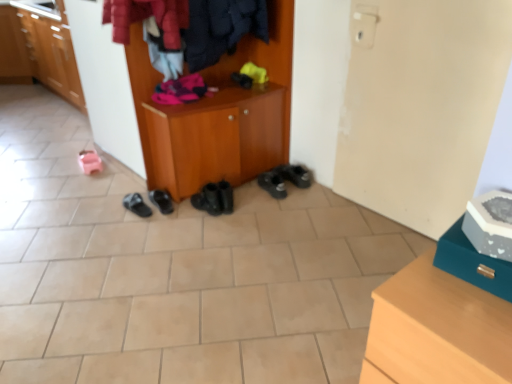
The height and width of the screenshot is (384, 512). What do you see at coordinates (217, 114) in the screenshot?
I see `wooden cabinet at center, the 1th cabinetry in the front-to-back sequence` at bounding box center [217, 114].

The width and height of the screenshot is (512, 384). What are the coordinates of `wooden cabinet at center, which appears as the second cabinetry when viewed from the left` in the screenshot? It's located at (217, 114).

Describe the element at coordinates (490, 224) in the screenshot. The width and height of the screenshot is (512, 384). I see `white matte shoe at upper right, the 2th shoe when ordered from bottom to top` at that location.

This screenshot has width=512, height=384. What are the coordinates of `velvet-like red coat at upper center` in the screenshot? It's located at (191, 25).

Image resolution: width=512 pixels, height=384 pixels. I want to click on matte wood cabinet at left, the second cabinetry positioned from the right, so click(x=39, y=48).

Measure the distance between point [282,167] and camera.

Point [282,167] is 2.88 meters away from camera.

Locate an element on the screen. wooden cabinet at center, placed as the second cabinetry when sorted from back to front is located at coordinates (217, 114).

Who is smaller, black rubber shoes at center, arranged as the 5th footwear when viewed from the left, or black rubber boots at center, arranged as the 3th footwear when viewed from the right?

black rubber boots at center, arranged as the 3th footwear when viewed from the right, is smaller.

What's the angular difference between black rubber shoes at center, the second footwear in the right-to-left sequence, and black rubber boots at center, the 4th footwear viewed from the left,'s facing directions?

There is a 14.4-degree angle between the facing directions of black rubber shoes at center, the second footwear in the right-to-left sequence, and black rubber boots at center, the 4th footwear viewed from the left.

From a real-world perspective, which object rests below the other?

black rubber shoes at center, the second footwear in the right-to-left sequence, from a real-world perspective.

Is black rubber boots at center, arranged as the 3th footwear when viewed from the right, turned away from matte wood cabinet at left, the second cabinetry positioned from the right?

Yes, black rubber boots at center, arranged as the 3th footwear when viewed from the right, is positioned with its back facing matte wood cabinet at left, the second cabinetry positioned from the right.

Can you see black rubber boots at center, arranged as the 3th footwear when viewed from the right, touching matte wood cabinet at left, the second cabinetry positioned from the right?

No, black rubber boots at center, arranged as the 3th footwear when viewed from the right, is not next to matte wood cabinet at left, the second cabinetry positioned from the right.

Considering the positions of objects black rubber boots at center, arranged as the 3th footwear when viewed from the right, and matte wood cabinet at left, which is the 1th cabinetry from top to bottom, in the image provided, who is behind, black rubber boots at center, arranged as the 3th footwear when viewed from the right, or matte wood cabinet at left, which is the 1th cabinetry from top to bottom,?

matte wood cabinet at left, which is the 1th cabinetry from top to bottom.

Considering the sizes of white matte shoe at upper right, the 2th shoe when ordered from bottom to top, and pink rubber sandals at lower left, which is the first footwear in left-to-right order, in the image, is white matte shoe at upper right, the 2th shoe when ordered from bottom to top, bigger or smaller than pink rubber sandals at lower left, which is the first footwear in left-to-right order,?

white matte shoe at upper right, the 2th shoe when ordered from bottom to top, is bigger than pink rubber sandals at lower left, which is the first footwear in left-to-right order.

From a real-world perspective, which is physically below, white matte shoe at upper right, marked as the first shoe in a top-to-bottom arrangement, or pink rubber sandals at lower left, marked as the 6th footwear in a right-to-left arrangement?

pink rubber sandals at lower left, marked as the 6th footwear in a right-to-left arrangement, is physically lower.

From the image's perspective, which is below, white matte shoe at upper right, marked as the first shoe in a top-to-bottom arrangement, or pink rubber sandals at lower left, which is the first footwear in left-to-right order?

white matte shoe at upper right, marked as the first shoe in a top-to-bottom arrangement, from the image's perspective.

From a real-world perspective, who is located lower, velvet-like red coat at upper center or black rubber shoes at center, the second footwear in the right-to-left sequence?

black rubber shoes at center, the second footwear in the right-to-left sequence, is physically lower.

In terms of height, does velvet-like red coat at upper center look taller or shorter compared to black rubber shoes at center, arranged as the 5th footwear when viewed from the left?

Considering their sizes, velvet-like red coat at upper center has more height than black rubber shoes at center, arranged as the 5th footwear when viewed from the left.

Which is behind, point (168, 5) or point (285, 166)?

Point (285, 166)

Relative to black rubber shoes at center, arranged as the 5th footwear when viewed from the left, is velvet-like red coat at upper center in front or behind?

velvet-like red coat at upper center is positioned closer to the viewer than black rubber shoes at center, arranged as the 5th footwear when viewed from the left.

From the picture: Is black rubber boots at center, the 4th footwear viewed from the left, surrounding white matte shoe at upper right, the 2th shoe when ordered from bottom to top?

No.

Is point (215, 188) closer to camera compared to point (507, 236)?

No, it is behind (507, 236).

From the black rubber boots at center, arranged as the 3th footwear when viewed from the right, count 1st shoe to the right and point to it. Please provide its 2D coordinates.

[(490, 224)]

Is wooden cabinet at center, which appears as the second cabinetry when viewed from the left, to the left or to the right of white matte shoe at upper right, marked as the first shoe in a top-to-bottom arrangement, in the image?

In the image, wooden cabinet at center, which appears as the second cabinetry when viewed from the left, appears on the left side of white matte shoe at upper right, marked as the first shoe in a top-to-bottom arrangement.

From a real-world perspective, is wooden cabinet at center, marked as the first cabinetry in a right-to-left arrangement, below white matte shoe at upper right, marked as the first shoe in a top-to-bottom arrangement?

Yes, from a real-world perspective, wooden cabinet at center, marked as the first cabinetry in a right-to-left arrangement, is under white matte shoe at upper right, marked as the first shoe in a top-to-bottom arrangement.

How different are the orientations of wooden cabinet at center, which is counted as the second cabinetry, starting from the top, and white matte shoe at upper right, the 2th shoe when ordered from bottom to top, in degrees?

There is a 91.4-degree angle between the facing directions of wooden cabinet at center, which is counted as the second cabinetry, starting from the top, and white matte shoe at upper right, the 2th shoe when ordered from bottom to top.

Could white matte shoe at upper right, the 2th shoe when ordered from bottom to top, be considered to be inside wooden cabinet at center, marked as the first cabinetry in a right-to-left arrangement?

That's incorrect, white matte shoe at upper right, the 2th shoe when ordered from bottom to top, is not inside wooden cabinet at center, marked as the first cabinetry in a right-to-left arrangement.

Does point (16, 80) appear closer or farther from the camera than point (229, 67)?

Clearly, point (16, 80) is more distant from the camera than point (229, 67).

Considering the sizes of objects matte wood cabinet at left, the first cabinetry viewed from the back, and wooden cabinet at center, which is counted as the second cabinetry, starting from the top, in the image provided, who is smaller, matte wood cabinet at left, the first cabinetry viewed from the back, or wooden cabinet at center, which is counted as the second cabinetry, starting from the top,?

wooden cabinet at center, which is counted as the second cabinetry, starting from the top, is smaller.

The image size is (512, 384). I want to click on cabinetry in front of the matte wood cabinet at left, which is the 1th cabinetry from top to bottom, so click(217, 114).

From the picture: From the image's perspective, which one is positioned higher, matte wood cabinet at left, the second cabinetry positioned from the right, or wooden cabinet at center, marked as the first cabinetry in a right-to-left arrangement?

matte wood cabinet at left, the second cabinetry positioned from the right, is shown above in the image.

From a real-world perspective, starting from the black rubber boots at center, the 4th footwear viewed from the left, which footwear is the 1st one below it? Please provide its 2D coordinates.

[(284, 179)]

There is a black rubber boots at center, arranged as the 3th footwear when viewed from the right. Where is `the 1st cabinetry above it (from a real-world perspective)`? the 1st cabinetry above it (from a real-world perspective) is located at coordinates (39, 48).

Considering their positions, is black rubber boots at center, the 4th footwear viewed from the left, positioned further to black rubber shoes at center, the 3th footwear positioned from the left, than black rubber shoes at center, the second footwear in the right-to-left sequence?

Among the two, black rubber shoes at center, the second footwear in the right-to-left sequence, is located further to black rubber shoes at center, the 3th footwear positioned from the left.

Looking at the image, which one is located further to black rubber shoes at center, the 4th footwear positioned from the right, black rubber shoes at center, the second footwear in the right-to-left sequence, or wooden cabinet at center, which is counted as the second cabinetry, starting from the top?

black rubber shoes at center, the second footwear in the right-to-left sequence, lies further to black rubber shoes at center, the 4th footwear positioned from the right, than the other object.

Based on their spatial positions, is black rubber shoes at center, the 4th footwear positioned from the right, or black rubber shoes at lower right, positioned as the 1th footwear in right-to-left order, further from white matte shoe at upper right, the 2th shoe when ordered from bottom to top?

The object further to white matte shoe at upper right, the 2th shoe when ordered from bottom to top, is black rubber shoes at center, the 4th footwear positioned from the right.

From the image, which object appears to be nearer to white matte shoe at upper right, the 2th shoe when ordered from bottom to top, black rubber shoes at lower right, positioned as the 1th footwear in right-to-left order, or black rubber boots at center, arranged as the 3th footwear when viewed from the right?

black rubber boots at center, arranged as the 3th footwear when viewed from the right, is positioned closer to the anchor white matte shoe at upper right, the 2th shoe when ordered from bottom to top.

Considering their positions, is teal leather shoe at lower right, which is the second shoe from top to bottom, positioned further to black rubber boots at center, the 4th footwear viewed from the left, than pink rubber sandals at lower left, which is the first footwear in left-to-right order?

Among the two, teal leather shoe at lower right, which is the second shoe from top to bottom, is located further to black rubber boots at center, the 4th footwear viewed from the left.

Which object lies nearer to the anchor point teak wood chest of drawers at lower right, wooden cabinet at center, the 1th cabinetry in the front-to-back sequence, or black rubber boots at center, the 4th footwear viewed from the left?

Based on the image, black rubber boots at center, the 4th footwear viewed from the left, appears to be nearer to teak wood chest of drawers at lower right.

Estimate the real-world distances between objects in this image. Which object is closer to black rubber sandals at center, which appears as the second footwear when viewed from the left, teak wood chest of drawers at lower right or velvet-like red coat at upper center?

The object closer to black rubber sandals at center, which appears as the second footwear when viewed from the left, is velvet-like red coat at upper center.

From the image, which object appears to be farther from black rubber shoes at center, the 3th footwear positioned from the left, black rubber boots at center, the 4th footwear viewed from the left, or black rubber shoes at lower right, positioned as the 1th footwear in right-to-left order?

The object further to black rubber shoes at center, the 3th footwear positioned from the left, is black rubber shoes at lower right, positioned as the 1th footwear in right-to-left order.

The width and height of the screenshot is (512, 384). I want to click on footwear positioned between teak wood chest of drawers at lower right and black rubber sandals at center, which appears as the second footwear when viewed from the left, from near to far, so click(x=214, y=198).

I want to click on cabinetry positioned between white matte shoe at upper right, marked as the first shoe in a top-to-bottom arrangement, and black rubber sandals at center, placed as the 5th footwear when sorted from right to left, from near to far, so click(217, 114).

Where is `footwear between matte wood cabinet at left, the first cabinetry viewed from the back, and black rubber sandals at center, which appears as the second footwear when viewed from the left`? The width and height of the screenshot is (512, 384). footwear between matte wood cabinet at left, the first cabinetry viewed from the back, and black rubber sandals at center, which appears as the second footwear when viewed from the left is located at coordinates (89, 161).

Find the location of a particular element. The height and width of the screenshot is (384, 512). clothing between teak wood chest of drawers at lower right and matte wood cabinet at left, the first cabinetry viewed from the back, in the front-back direction is located at coordinates (191, 25).